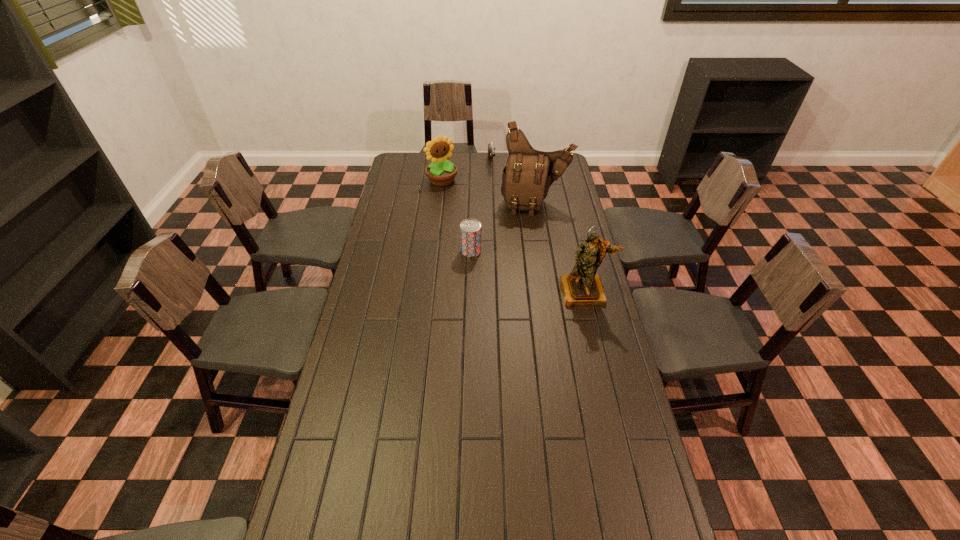
Image resolution: width=960 pixels, height=540 pixels. I want to click on free space between the leftmost object and the fourth object from right to left, so click(457, 215).

Locate an element on the screen. vacant space that's between the fourth object from right to left and the second tallest object is located at coordinates (528, 271).

The width and height of the screenshot is (960, 540). Identify the location of free area in between the figurine and the beer can. (528, 271).

The width and height of the screenshot is (960, 540). Find the location of `empty space that is in between the pistol and the figurine`. empty space that is in between the pistol and the figurine is located at coordinates (538, 227).

Find the location of a particular element. Image resolution: width=960 pixels, height=540 pixels. free space that is in between the second nearest object and the second tallest object is located at coordinates (528, 271).

Where is `blank region between the third nearest object and the sunflower`? The width and height of the screenshot is (960, 540). blank region between the third nearest object and the sunflower is located at coordinates (489, 192).

Locate an element on the screen. The width and height of the screenshot is (960, 540). free space that is in between the leftmost object and the third object from right to left is located at coordinates (467, 172).

Locate an element on the screen. This screenshot has height=540, width=960. vacant point located between the pistol and the leftmost object is located at coordinates (467, 172).

Find the location of `object that is the fourth closest to the second tallest object`. object that is the fourth closest to the second tallest object is located at coordinates pyautogui.click(x=491, y=147).

The image size is (960, 540). Identify the location of the third closest object to the leftmost object. (470, 229).